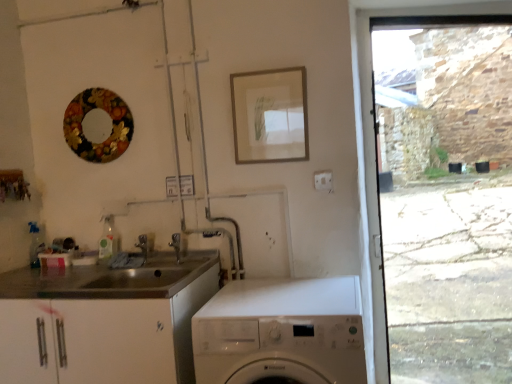
Locate an element on the screen. The height and width of the screenshot is (384, 512). vacant area that is in front of silver metallic tap at center, which appears as the first tap when viewed from the back is located at coordinates (146, 273).